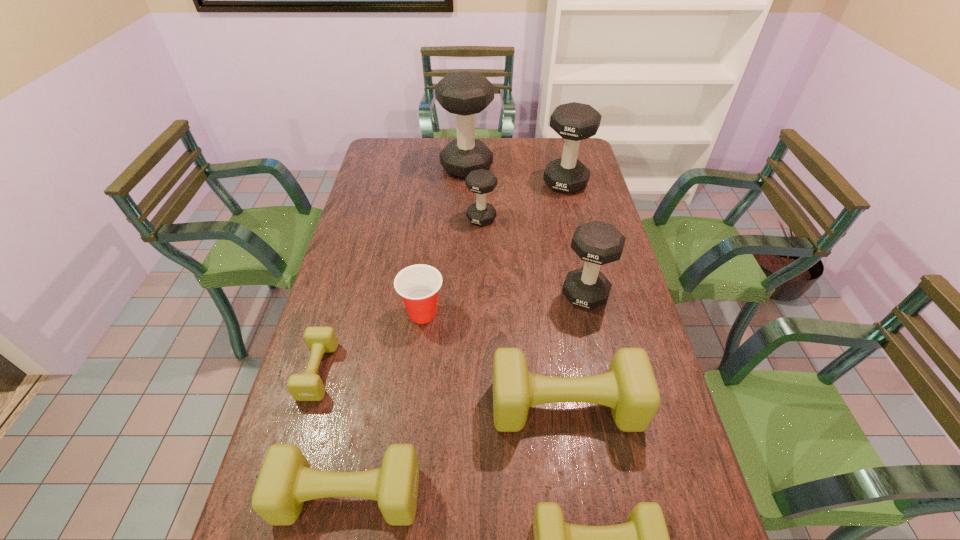
Find the location of `vacant space located on the back of the shortest object`. vacant space located on the back of the shortest object is located at coordinates (347, 275).

Where is `object at the far edge`? object at the far edge is located at coordinates (464, 93).

Identify the location of free space at the far edge of the desktop. (508, 164).

This screenshot has height=540, width=960. I want to click on vacant space at the left edge of the desktop, so click(353, 407).

The image size is (960, 540). Find the location of `vacant space that is in between the tallest object and the second tallest object`. vacant space that is in between the tallest object and the second tallest object is located at coordinates (516, 176).

The height and width of the screenshot is (540, 960). I want to click on vacant space that is in between the shortest object and the cup, so click(371, 342).

I want to click on vacant area that lies between the third farthest dumbbell and the red cup, so click(x=452, y=266).

You are a GUI agent. You are given a task and a screenshot of the screen. Output one action in this format:
    pyautogui.click(x=<x>, y=<y>)
    Task: Click on the unoccupied position between the third shortest dumbbell and the shortest dumbbell
    
    Given the screenshot: What is the action you would take?
    pyautogui.click(x=333, y=433)

Locate an element on the screen. The image size is (960, 540). blank region between the biggest gray dumbbell and the red cup is located at coordinates (444, 240).

Identify the location of free spot between the third tallest object and the biggest olive dumbbell. (575, 350).